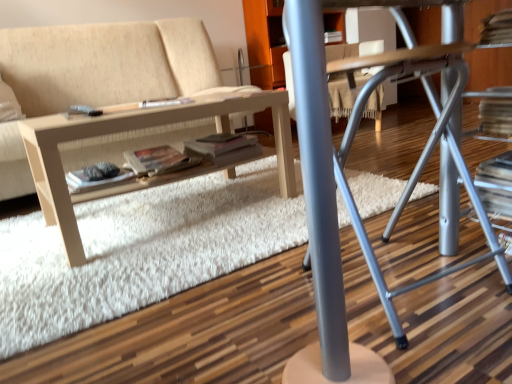
Question: Is light wood/texture table at lower left beside metallic gray computer desk at center?

Choices:
 (A) yes
 (B) no

Answer: (B)

Question: From a real-world perspective, does light wood/texture table at lower left sit lower than metallic gray computer desk at center?

Choices:
 (A) no
 (B) yes

Answer: (B)

Question: Is metallic gray computer desk at center located within light wood/texture table at lower left?

Choices:
 (A) yes
 (B) no

Answer: (B)

Question: Can you confirm if light wood/texture table at lower left is smaller than metallic gray computer desk at center?

Choices:
 (A) no
 (B) yes

Answer: (B)

Question: Does light wood/texture table at lower left have a lesser width compared to metallic gray computer desk at center?

Choices:
 (A) yes
 (B) no

Answer: (B)

Question: Are light wood/texture table at lower left and metallic gray computer desk at center located far from each other?

Choices:
 (A) no
 (B) yes

Answer: (A)

Question: Considering the relative positions of matte paper paperback book at center, the second paperback book viewed from the left, and matte gray magazine at center in the image provided, is matte paper paperback book at center, the second paperback book viewed from the left, behind matte gray magazine at center?

Choices:
 (A) yes
 (B) no

Answer: (B)

Question: From a real-world perspective, is matte paper paperback book at center, the second paperback book viewed from the left, under matte gray magazine at center?

Choices:
 (A) no
 (B) yes

Answer: (B)

Question: Is matte paper paperback book at center, the second paperback book viewed from the left, not inside matte gray magazine at center?

Choices:
 (A) yes
 (B) no

Answer: (A)

Question: Is matte paper paperback book at center, the first paperback book viewed from the right, to the left of matte gray magazine at center from the viewer's perspective?

Choices:
 (A) yes
 (B) no

Answer: (A)

Question: From a real-world perspective, is matte paper paperback book at center, the first paperback book viewed from the right, positioned over matte gray magazine at center based on gravity?

Choices:
 (A) no
 (B) yes

Answer: (A)

Question: Is matte paper paperback book at center, the second paperback book viewed from the left, thinner than matte gray magazine at center?

Choices:
 (A) yes
 (B) no

Answer: (B)

Question: Is matte gray magazine at center aimed at white shag rug at center?

Choices:
 (A) no
 (B) yes

Answer: (A)